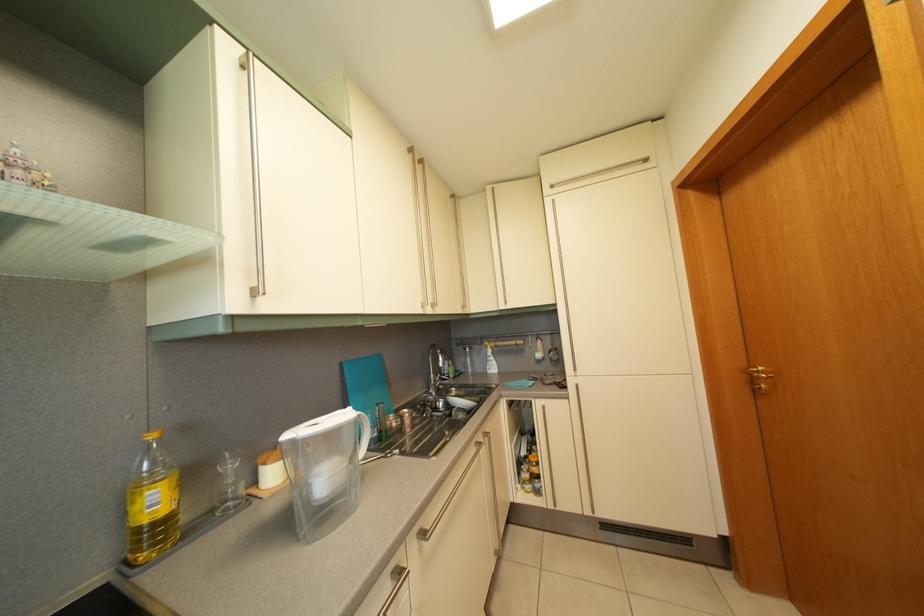
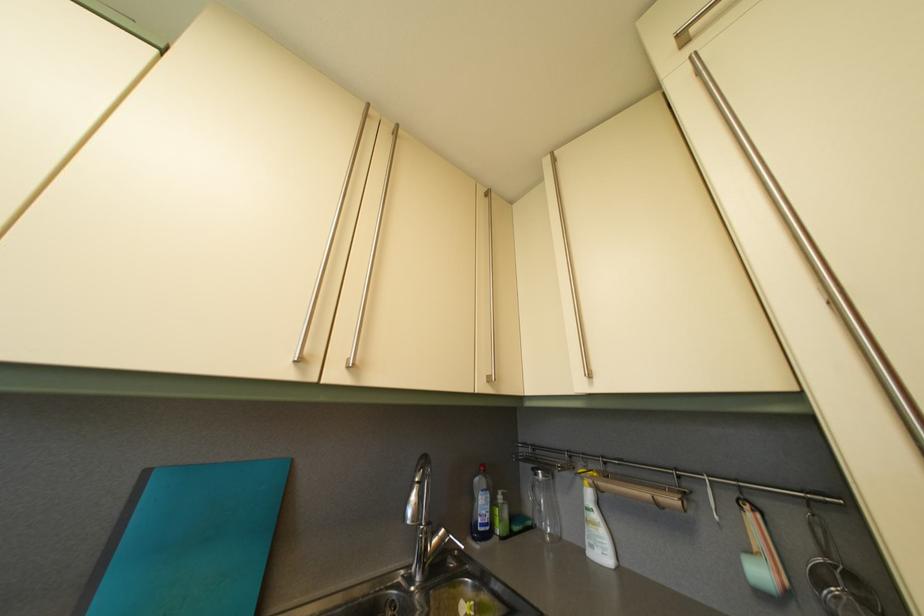
The point at (473, 357) is marked in the first image. Where is the corresponding point in the second image?

(544, 482)